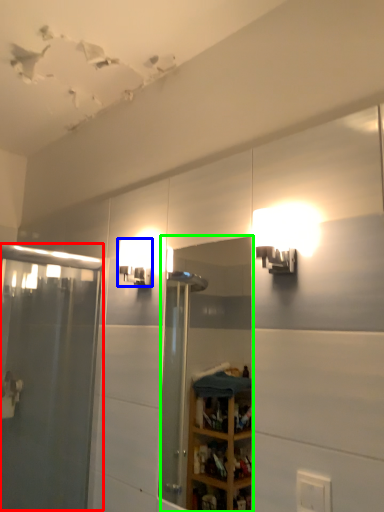
Question: Considering the real-world distances, which object is closest to screen door (highlighted by a red box)? light fixture (highlighted by a blue box) or mirror (highlighted by a green box).

Choices:
 (A) light fixture
 (B) mirror

Answer: (A)